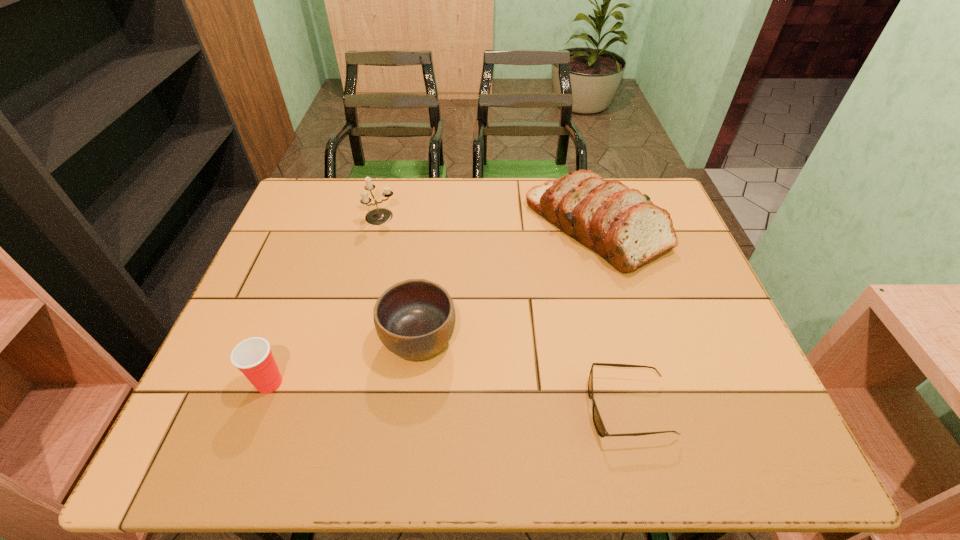
Select which object is the fourth closest to the leftmost object. Please provide its 2D coordinates. Your answer should be formatted as a tuple, i.e. [(x, y)], where the tuple contains the x and y coordinates of a point satisfying the conditions above.

[(597, 420)]

Find the location of `vacant region that satisfies the following two spatial constraints: 1. on the back side of the bread; 2. on the left side of the bowl`. vacant region that satisfies the following two spatial constraints: 1. on the back side of the bread; 2. on the left side of the bowl is located at coordinates (432, 227).

Where is `vacant space that satisfies the following two spatial constraints: 1. on the back side of the leftmost object; 2. on the right side of the bowl`? This screenshot has width=960, height=540. vacant space that satisfies the following two spatial constraints: 1. on the back side of the leftmost object; 2. on the right side of the bowl is located at coordinates click(x=285, y=340).

Identify the location of vacant space that satisfies the following two spatial constraints: 1. on the front side of the candle holder; 2. on the right side of the third object from right to left. (350, 340).